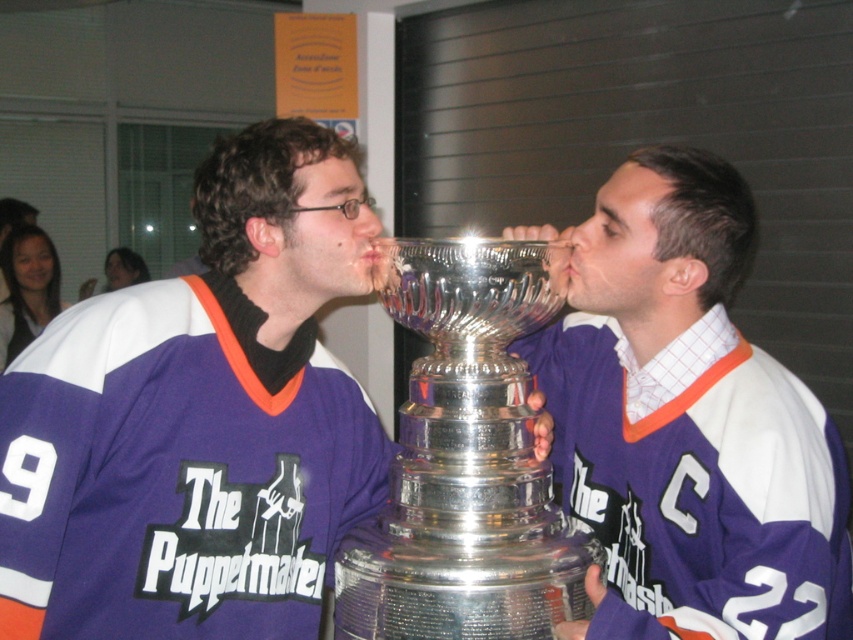
Who is more forward, (x=234, y=209) or (x=572, y=445)?

Point (x=234, y=209) is more forward.

Identify the location of matte purple jersey at center. Image resolution: width=853 pixels, height=640 pixels. (198, 420).

Which is behind, point (234, 426) or point (544, 390)?

The point (544, 390) is more distant.

Find the location of `matte purple jersey at center`. matte purple jersey at center is located at coordinates point(198,420).

Between smooth skin nose at center and matte plastic nose at center, which one has more height?

smooth skin nose at center is taller.

Consider the image. Which of these two, smooth skin nose at center or matte plastic nose at center, stands shorter?

Standing shorter between the two is matte plastic nose at center.

Identify the location of smooth skin nose at center. (587, 234).

Is purple jersey at center smaller than smooth skin nose at center?

No.

Is purple jersey at center positioned in front of smooth skin nose at center?

Yes, purple jersey at center is in front of smooth skin nose at center.

Who is more forward, (668,504) or (589,248)?

Point (668,504)

Locate an element on the screen. purple jersey at center is located at coordinates point(688,426).